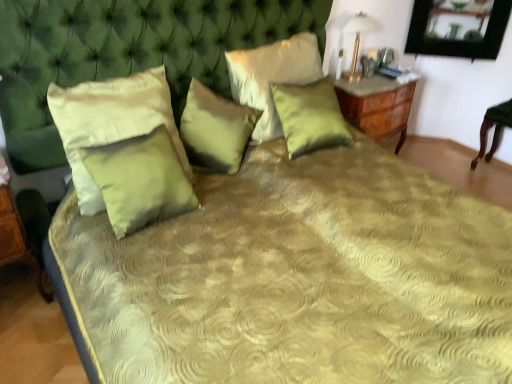
At what (x,y) coordinates should I click in order to perform the action: click on empty space that is ontop of wooden nightstand at right (from a real-world perspective). Please return your answer as a coordinate pair (x, y). This screenshot has width=512, height=384. Looking at the image, I should click on (380, 82).